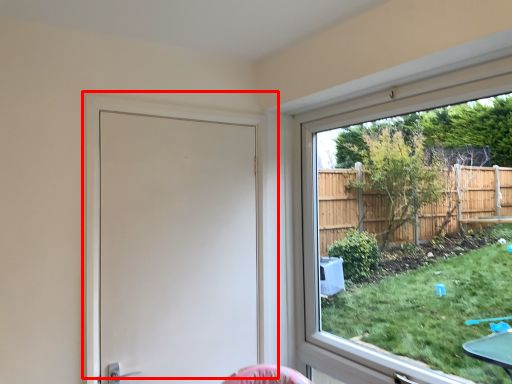
Question: From the image's perspective, what is the correct spatial relationship of door (annotated by the red box) in relation to window?

Choices:
 (A) above
 (B) below

Answer: (B)